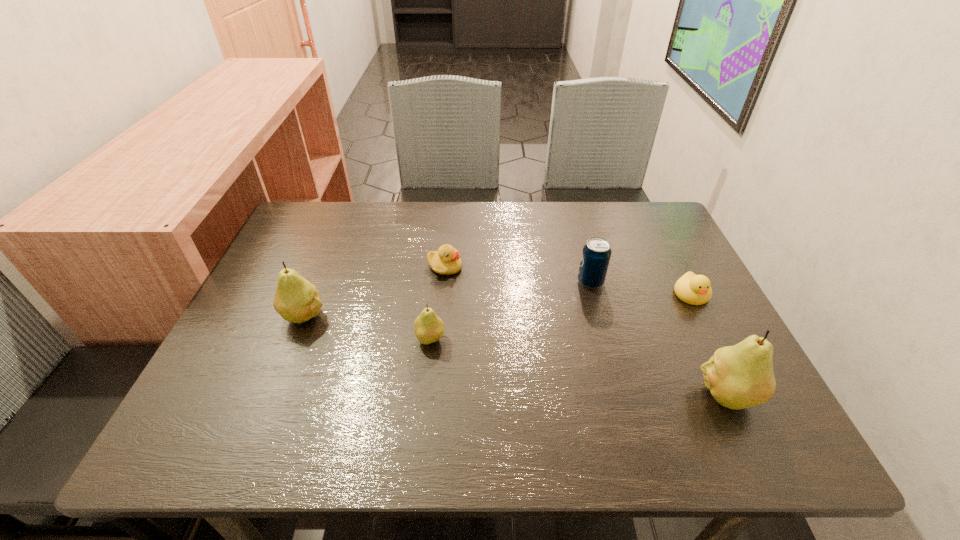
Please point a space for a new pear to maintain equal intervals. Please provide its 2D coordinates. Your answer should be formatted as a tuple, i.e. [(x, y)], where the tuple contains the x and y coordinates of a point satisfying the conditions above.

[(570, 365)]